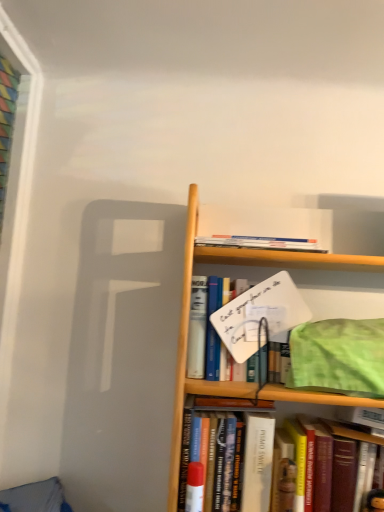
Question: Considering the positions of point (216, 457) and point (311, 413), is point (216, 457) closer or farther from the camera than point (311, 413)?

Choices:
 (A) farther
 (B) closer

Answer: (B)

Question: From a real-world perspective, is hardcover book at center, the 2th book in the bottom-to-top sequence, physically located above or below hardcover book at center, which appears as the third book when viewed from the top?

Choices:
 (A) below
 (B) above

Answer: (A)

Question: Estimate the real-world distances between objects in this image. Which object is closer to the hardcover book at center, the 4th book when ordered from top to bottom?

Choices:
 (A) hardcover book at center, which appears as the 1th book when ordered from the bottom
 (B) hardcover book at center, which appears as the third book when viewed from the top
 (C) white paperboard sign at center, which is the second book from top to bottom
 (D) hardcover book at upper center, arranged as the fifth book when ordered from the bottom

Answer: (B)

Question: Estimate the real-world distances between objects in this image. Which object is farther from the white paperboard sign at center, which is the second book from top to bottom?

Choices:
 (A) hardcover book at center, which appears as the third book when viewed from the top
 (B) hardcover book at center, the 2th book in the bottom-to-top sequence
 (C) hardcover book at upper center, arranged as the fifth book when ordered from the bottom
 (D) hardcover book at center, the fifth book in the top-to-bottom sequence

Answer: (D)